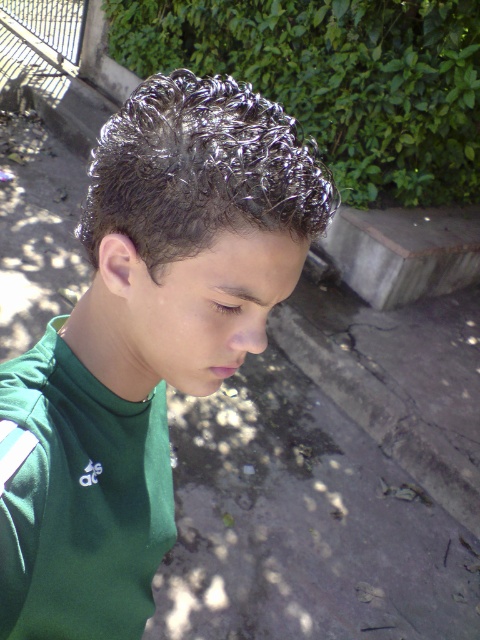
You are a photographer adjusting your camera settings. You notice the green matte shirt at center and the shiny metallic hair at upper center. Which object should you focus on first to ensure proper depth of field?

The green matte shirt at center is closer to the viewer than the shiny metallic hair at upper center, so focusing on it first will help achieve proper depth of field.

You are a fashion designer observing the image. You need to determine if the distance between the green matte shirt at center and the shiny metallic hair at upper center is sufficient to allow a 4 inch wide decorative ribbon to be placed between them. Can you confirm if this is possible?

The green matte shirt at center is 4.29 inches away from the shiny metallic hair at upper center. Since the distance between them is greater than 4 inches, the decorative ribbon can be placed between them.